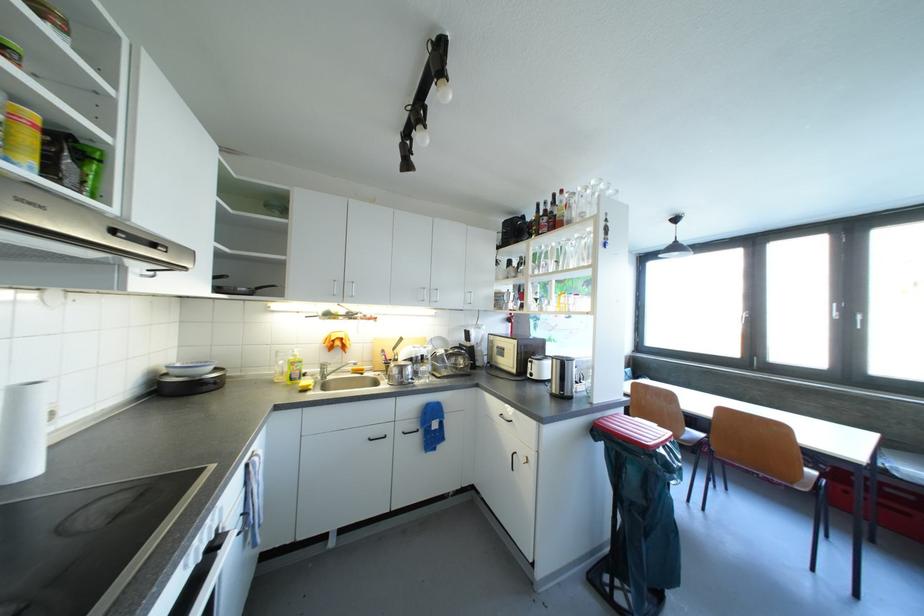
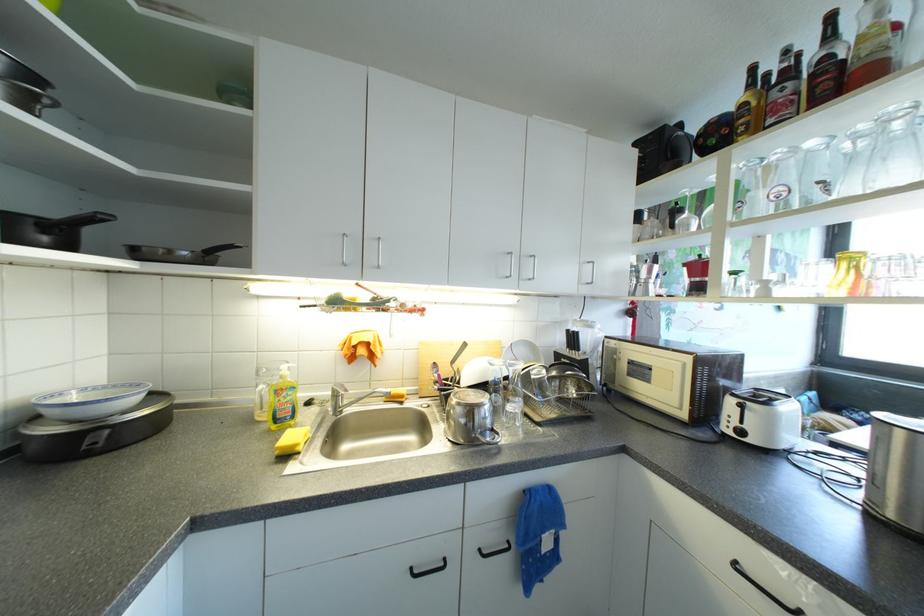
In the second image, find the point that corresponds to (301,355) in the first image.

(290, 373)